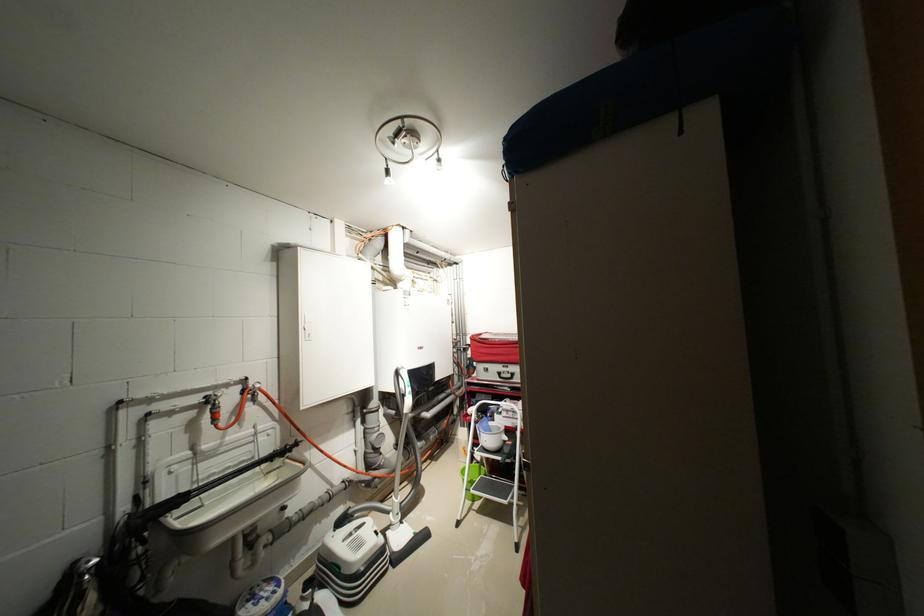
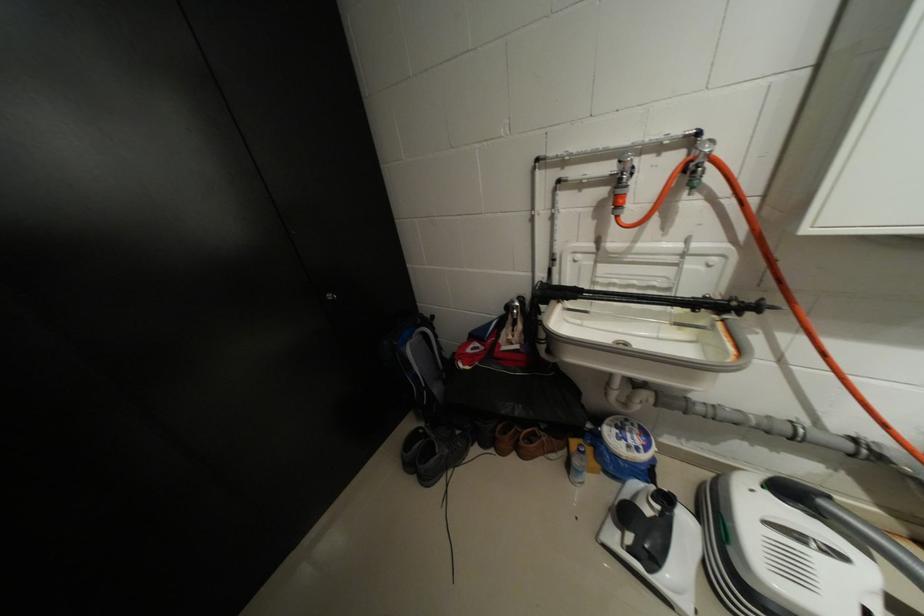
The images are taken continuously from a first-person perspective. In which direction is your viewpoint rotating?

The camera's rotation is toward left-down.